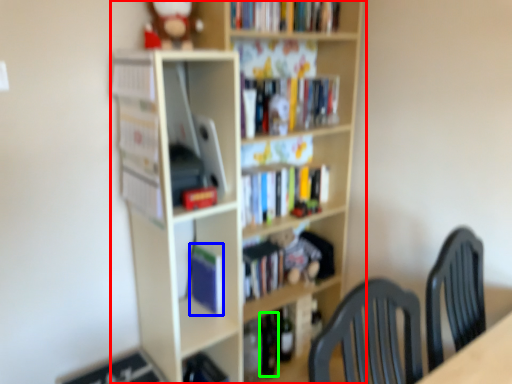
Question: Estimate the real-world distances between objects in this image. Which object is closer to bookcase (highlighted by a red box), paperback book (highlighted by a blue box) or wine bottle (highlighted by a green box)?

Choices:
 (A) paperback book
 (B) wine bottle

Answer: (A)